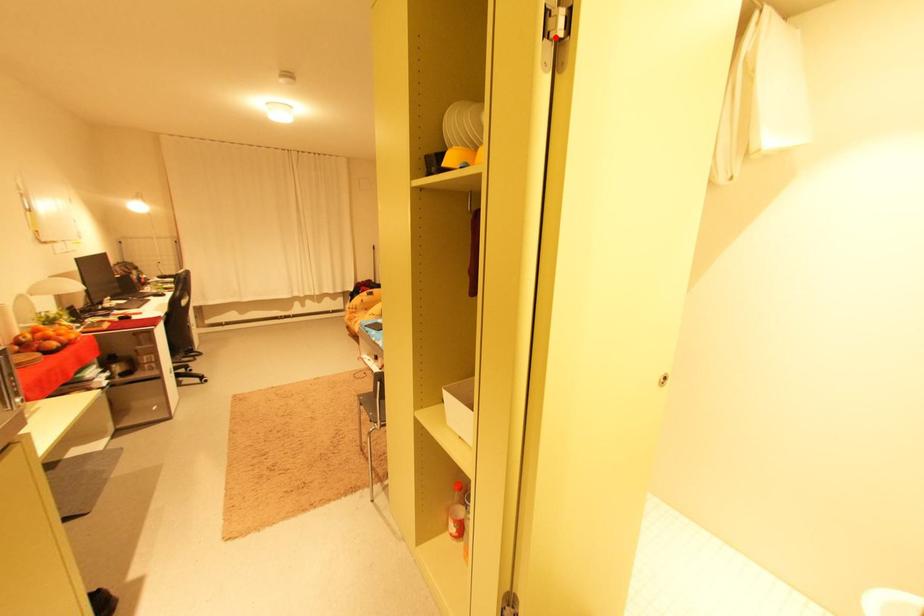
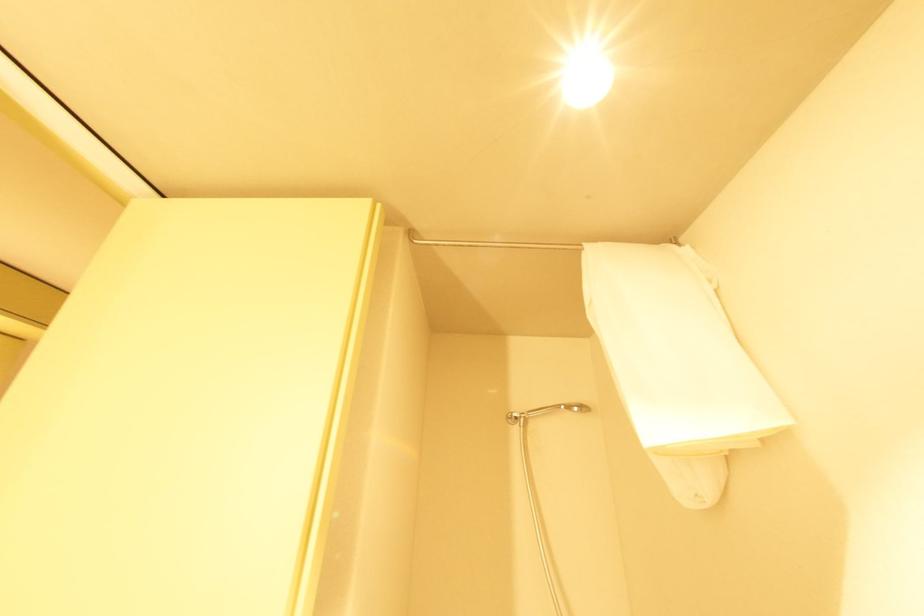
Question: I am providing you with two images of the same scene from different viewpoints. A red point is marked on the first image. At the location where the point appears in image 1, is it still visible in image 2?

Choices:
 (A) Yes
 (B) No

Answer: (B)